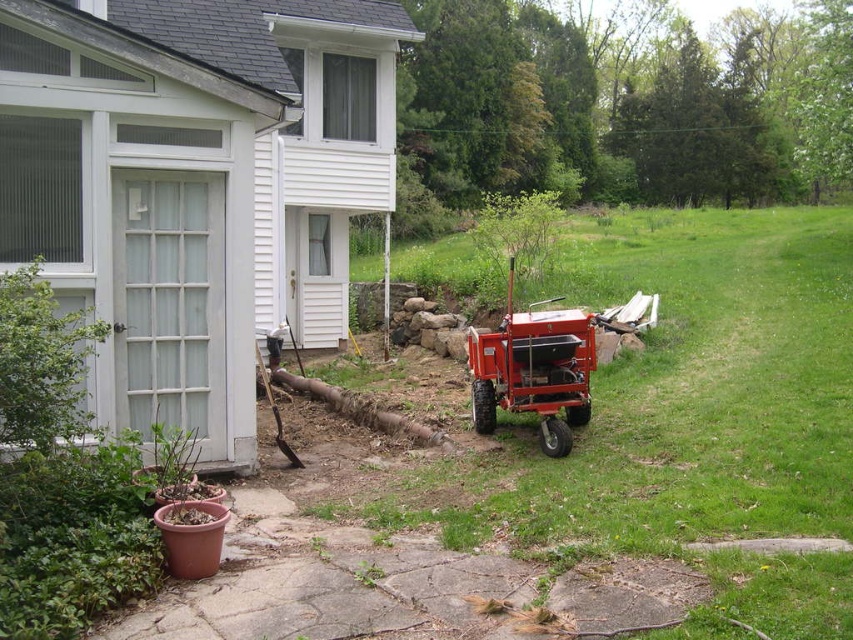
Does green grass at center appear under orange metallic tractor at center?

Actually, green grass at center is above orange metallic tractor at center.

Find the location of a particular element. green grass at center is located at coordinates (677, 397).